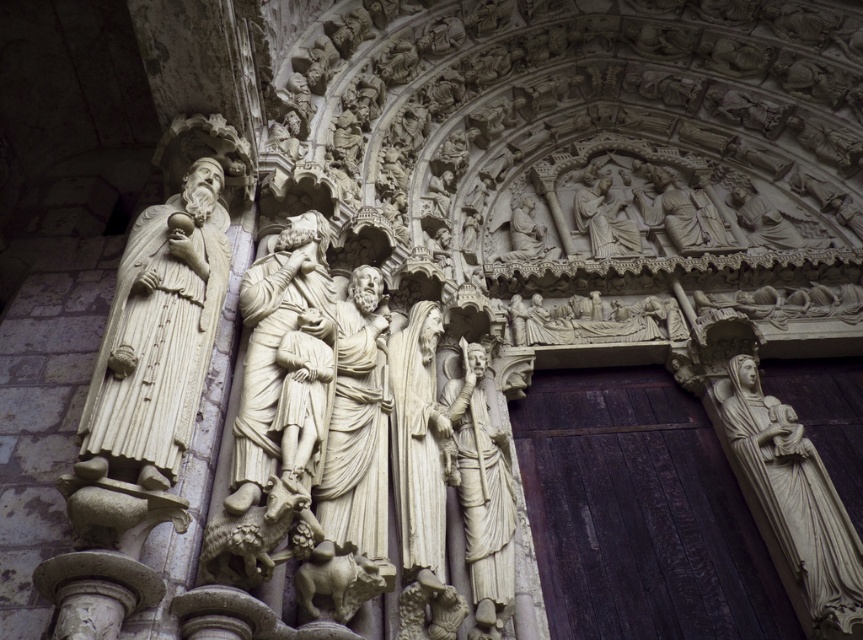
You are an architect inspecting the Gothic facade. You need to install a new security camera. The camera must be placed between the dark wood door at right and the white marble statue at left. Given their sizes, which object should the camera be closer to?

The dark wood door at right has a larger size compared to the white marble statue at left, so the camera should be placed closer to the dark wood door at right to ensure it can cover both objects adequately.

You are an art conservator assessing the Gothic facade. You need to determine if the white marble statue at left can fit into a storage space designed for statues up to 1.2 meters in width. Given that the white marble statue at right is 1.5 meters wide, what should you conclude?

The white marble statue at left has a lesser width compared to the white marble statue at right, which is 1.5 meters wide. Therefore, the statue at left is narrower than 1.5 meters. Since the storage space allows up to 1.2 meters, it depends on the exact width of the left statue. However, without specific measurements, we cannot confirm if it fits. Further measurement is required.